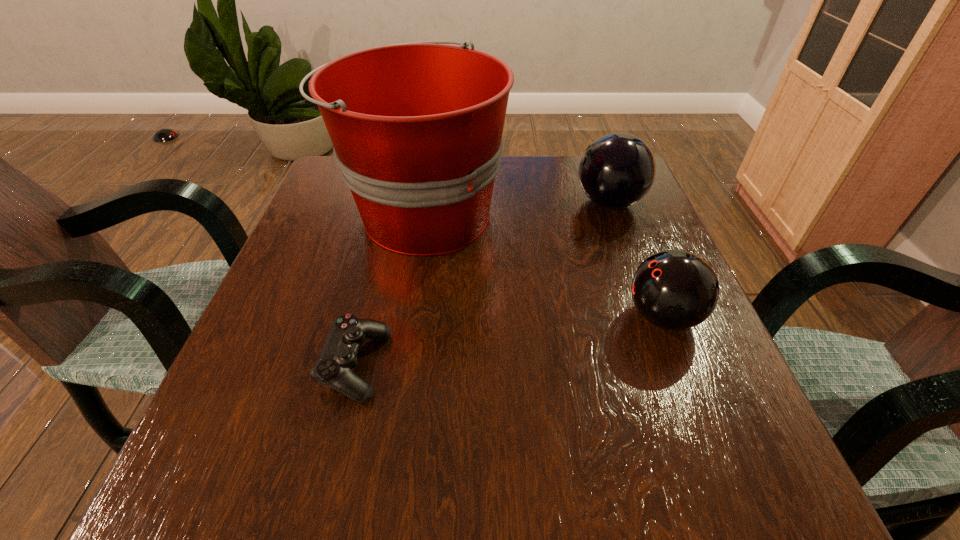
The width and height of the screenshot is (960, 540). What are the coordinates of `free space located on the surface of the third tallest object near the finger holes` in the screenshot? It's located at (522, 316).

Where is `vacant space situated on the surface of the third tallest object near the finger holes`? The width and height of the screenshot is (960, 540). vacant space situated on the surface of the third tallest object near the finger holes is located at coordinates (408, 316).

This screenshot has width=960, height=540. Identify the location of vacant space located on the surface of the third tallest object near the finger holes. (579, 316).

The width and height of the screenshot is (960, 540). In order to click on vacant space located 0.070m on the front of the control in this screenshot , I will do 334,454.

This screenshot has height=540, width=960. In order to click on bucket located at the far edge in this screenshot , I will do `click(417, 127)`.

You are a GUI agent. You are given a task and a screenshot of the screen. Output one action in this format:
    pyautogui.click(x=<x>, y=<y>)
    Task: Click on the bowling ball present at the far edge
    The height and width of the screenshot is (540, 960).
    Given the screenshot: What is the action you would take?
    pyautogui.click(x=617, y=170)

This screenshot has width=960, height=540. I want to click on bucket that is positioned at the left edge, so click(x=417, y=127).

This screenshot has width=960, height=540. What are the coordinates of `control that is at the left edge` in the screenshot? It's located at (338, 357).

The width and height of the screenshot is (960, 540). Find the location of `object present at the far left corner`. object present at the far left corner is located at coordinates (417, 127).

Where is `object situated at the far right corner`? The width and height of the screenshot is (960, 540). object situated at the far right corner is located at coordinates (617, 170).